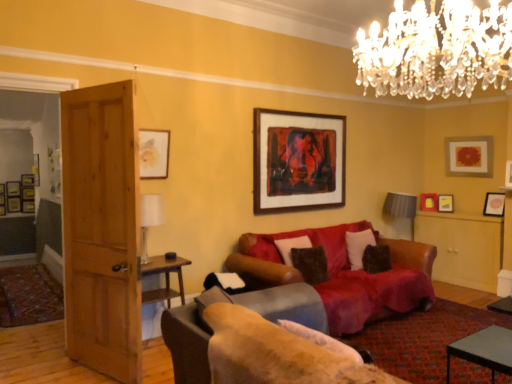
Question: Does velvet dark brown pillow at center, positioned as the second pillow in back-to-front order, have a larger size compared to matte wooden picture frame at upper left, placed as the tenth picture frame when sorted from right to left?

Choices:
 (A) no
 (B) yes

Answer: (B)

Question: Is velvet dark brown pillow at center, the second pillow positioned from the right, far from matte wooden picture frame at upper left, placed as the tenth picture frame when sorted from right to left?

Choices:
 (A) no
 (B) yes

Answer: (B)

Question: Does velvet dark brown pillow at center, acting as the 1th pillow starting from the front, appear on the right side of matte wooden picture frame at upper left, placed as the tenth picture frame when sorted from right to left?

Choices:
 (A) no
 (B) yes

Answer: (B)

Question: Is velvet dark brown pillow at center, the second pillow positioned from the right, smaller than matte wooden picture frame at upper left, placed as the tenth picture frame when sorted from right to left?

Choices:
 (A) no
 (B) yes

Answer: (A)

Question: Would you say velvet dark brown pillow at center, acting as the 1th pillow starting from the front, is outside matte wooden picture frame at upper left, acting as the 8th picture frame starting from the front?

Choices:
 (A) yes
 (B) no

Answer: (A)

Question: Would you say wooden picture frame at left, marked as the ninth picture frame in a front-to-back arrangement, is to the left or to the right of matte gold picture frame at upper right, which is counted as the fourth picture frame, starting from the front, in the picture?

Choices:
 (A) left
 (B) right

Answer: (A)

Question: Is point (9, 195) closer or farther from the camera than point (455, 148)?

Choices:
 (A) farther
 (B) closer

Answer: (A)

Question: Considering their positions, is wooden picture frame at left, which ranks as the second picture frame in back-to-front order, located in front of or behind matte gold picture frame at upper right, which appears as the ninth picture frame when viewed from the left?

Choices:
 (A) behind
 (B) front

Answer: (A)

Question: Is wooden picture frame at left, marked as the ninth picture frame in a front-to-back arrangement, wider or thinner than matte gold picture frame at upper right, which appears as the ninth picture frame when viewed from the left?

Choices:
 (A) thin
 (B) wide

Answer: (B)

Question: Is matte gold picture frame at upper right, the 5th picture frame from the back, inside or outside of white glossy table at lower right?

Choices:
 (A) outside
 (B) inside

Answer: (A)

Question: Is point (436, 201) positioned closer to the camera than point (487, 362)?

Choices:
 (A) closer
 (B) farther

Answer: (B)

Question: Is matte gold picture frame at upper right, the 5th picture frame from the back, in front of or behind white glossy table at lower right in the image?

Choices:
 (A) behind
 (B) front

Answer: (A)

Question: Considering the positions of matte gold picture frame at upper right, which is the 7th picture frame in left-to-right order, and white glossy table at lower right in the image, is matte gold picture frame at upper right, which is the 7th picture frame in left-to-right order, wider or thinner than white glossy table at lower right?

Choices:
 (A) thin
 (B) wide

Answer: (A)

Question: In terms of size, does wooden framed artwork at upper center, the fifth picture frame from the right, appear bigger or smaller than gray fabric lampshade at right, the 1th lamp when ordered from bottom to top?

Choices:
 (A) big
 (B) small

Answer: (B)

Question: From their relative heights in the image, would you say wooden framed artwork at upper center, the 2th picture frame viewed from the front, is taller or shorter than gray fabric lampshade at right, the first lamp positioned from the right?

Choices:
 (A) short
 (B) tall

Answer: (B)